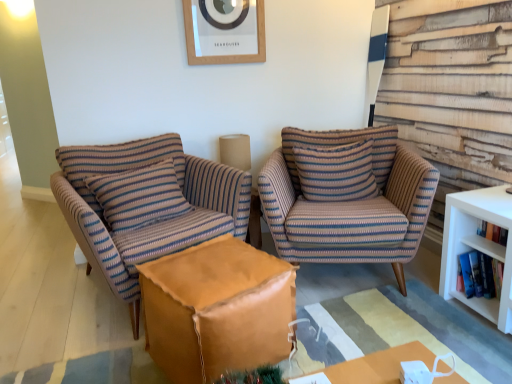
In order to click on striped fabric armchair at left, which is the first chair in left-to-right order in this screenshot , I will do `click(146, 204)`.

What do you see at coordinates (139, 196) in the screenshot? I see `striped fabric pillow at left, which appears as the second pillow when viewed from the right` at bounding box center [139, 196].

At what (x,y) coordinates should I click in order to perform the action: click on white paperbacks at right, positioned as the 1th book in bottom-to-top order. Please return your answer as a coordinate pair (x, y). This screenshot has width=512, height=384. Looking at the image, I should click on (477, 274).

What is the approximate height of striped fabric armchair at center, which appears as the first chair when viewed from the right?

striped fabric armchair at center, which appears as the first chair when viewed from the right, is 31.59 inches tall.

I want to click on leather ottoman at center, so click(x=217, y=309).

Based on the photo, is leather ottoman at center at the left side of white paperbacks at right, positioned as the 1th book in bottom-to-top order?

Correct, you'll find leather ottoman at center to the left of white paperbacks at right, positioned as the 1th book in bottom-to-top order.

Is leather ottoman at center bigger or smaller than white paperbacks at right, positioned as the 1th book in bottom-to-top order?

leather ottoman at center is bigger than white paperbacks at right, positioned as the 1th book in bottom-to-top order.

Is point (221, 335) positioned after point (480, 260)?

No.

Is leather ottoman at center aimed at white paperbacks at right, the second book when ordered from top to bottom?

No, leather ottoman at center is not aimed at white paperbacks at right, the second book when ordered from top to bottom.

Can we say hardcover book at right, arranged as the first book when viewed from the top, lies outside striped fabric pillow at center, the 1th pillow from the right?

That's correct, hardcover book at right, arranged as the first book when viewed from the top, is outside of striped fabric pillow at center, the 1th pillow from the right.

Is hardcover book at right, arranged as the 2th book when ordered from the bottom, oriented towards striped fabric pillow at center, the 2th pillow in the left-to-right sequence?

No, hardcover book at right, arranged as the 2th book when ordered from the bottom, is not oriented towards striped fabric pillow at center, the 2th pillow in the left-to-right sequence.

Can you confirm if white paperbacks at right, positioned as the 1th book in bottom-to-top order, is smaller than striped fabric pillow at center, the 1th pillow from the right?

Indeed, white paperbacks at right, positioned as the 1th book in bottom-to-top order, has a smaller size compared to striped fabric pillow at center, the 1th pillow from the right.

Is white paperbacks at right, positioned as the 1th book in bottom-to-top order, outside of striped fabric pillow at center, the 1th pillow from the right?

Yes, white paperbacks at right, positioned as the 1th book in bottom-to-top order, is located beyond the bounds of striped fabric pillow at center, the 1th pillow from the right.

From the image's perspective, which is below, white paperbacks at right, the second book when ordered from top to bottom, or striped fabric pillow at center, the 2th pillow in the left-to-right sequence?

From the image's view, white paperbacks at right, the second book when ordered from top to bottom, is below.

Locate an element on the screen. The image size is (512, 384). the 2nd pillow above when counting from the white paperbacks at right, the second book when ordered from top to bottom (from the image's perspective) is located at coordinates (336, 171).

Based on the photo, which object is thinner, striped fabric armchair at center, which appears as the first chair when viewed from the right, or striped fabric pillow at left, which appears as the second pillow when viewed from the right?

striped fabric pillow at left, which appears as the second pillow when viewed from the right.

Is striped fabric armchair at center, which is the second chair in left-to-right order, closer to the viewer compared to striped fabric pillow at left, which is the first pillow in left-to-right order?

Yes, the depth of striped fabric armchair at center, which is the second chair in left-to-right order, is less than that of striped fabric pillow at left, which is the first pillow in left-to-right order.

Does striped fabric armchair at center, which appears as the first chair when viewed from the right, appear on the left side of striped fabric pillow at left, which is the first pillow in left-to-right order?

In fact, striped fabric armchair at center, which appears as the first chair when viewed from the right, is to the right of striped fabric pillow at left, which is the first pillow in left-to-right order.

Would you consider striped fabric armchair at center, which is the second chair in left-to-right order, to be distant from striped fabric pillow at left, which is the first pillow in left-to-right order?

No, striped fabric armchair at center, which is the second chair in left-to-right order, is not far away from striped fabric pillow at left, which is the first pillow in left-to-right order.

The height and width of the screenshot is (384, 512). There is a striped fabric armchair at center, which is the second chair in left-to-right order. In order to click on the 2nd book below it (from a real-world perspective) in this screenshot , I will do `click(477, 274)`.

How different are the orientations of striped fabric armchair at center, which appears as the first chair when viewed from the right, and white paperbacks at right, the second book when ordered from top to bottom, in degrees?

The angular difference between striped fabric armchair at center, which appears as the first chair when viewed from the right, and white paperbacks at right, the second book when ordered from top to bottom, is 63.6 degrees.

Considering the sizes of objects striped fabric armchair at center, which is the second chair in left-to-right order, and white paperbacks at right, the second book when ordered from top to bottom, in the image provided, who is wider, striped fabric armchair at center, which is the second chair in left-to-right order, or white paperbacks at right, the second book when ordered from top to bottom,?

striped fabric armchair at center, which is the second chair in left-to-right order, is wider.

Does striped fabric armchair at center, which appears as the first chair when viewed from the right, have a larger size compared to white paperbacks at right, the second book when ordered from top to bottom?

Indeed, striped fabric armchair at center, which appears as the first chair when viewed from the right, has a larger size compared to white paperbacks at right, the second book when ordered from top to bottom.

Could striped fabric armchair at center, which appears as the first chair when viewed from the right, be considered to be inside striped fabric pillow at left, which is the first pillow in left-to-right order?

No.

How different are the orientations of striped fabric pillow at left, which appears as the second pillow when viewed from the right, and striped fabric armchair at center, which is the second chair in left-to-right order, in degrees?

There is a 41.6-degree angle between the facing directions of striped fabric pillow at left, which appears as the second pillow when viewed from the right, and striped fabric armchair at center, which is the second chair in left-to-right order.

Is striped fabric pillow at left, which is the first pillow in left-to-right order, in front of or behind striped fabric armchair at center, which appears as the first chair when viewed from the right, in the image?

striped fabric pillow at left, which is the first pillow in left-to-right order, is behind striped fabric armchair at center, which appears as the first chair when viewed from the right.

Considering the sizes of objects striped fabric pillow at left, which appears as the second pillow when viewed from the right, and striped fabric armchair at center, which is the second chair in left-to-right order, in the image provided, who is thinner, striped fabric pillow at left, which appears as the second pillow when viewed from the right, or striped fabric armchair at center, which is the second chair in left-to-right order,?

striped fabric pillow at left, which appears as the second pillow when viewed from the right, is thinner.

I want to click on the 2nd chair counting from the left of the hardcover book at right, arranged as the 2th book when ordered from the bottom, so click(x=146, y=204).

Is striped fabric armchair at left, which is the first chair in left-to-right order, further to the viewer compared to hardcover book at right, arranged as the first book when viewed from the top?

No, it is not.

Would you consider striped fabric armchair at left, marked as the second chair in a right-to-left arrangement, to be distant from hardcover book at right, arranged as the first book when viewed from the top?

striped fabric armchair at left, marked as the second chair in a right-to-left arrangement, is positioned a significant distance from hardcover book at right, arranged as the first book when viewed from the top.

From the image's perspective, is striped fabric armchair at left, which is the first chair in left-to-right order, over hardcover book at right, arranged as the 2th book when ordered from the bottom?

Yes, from the image's perspective, striped fabric armchair at left, which is the first chair in left-to-right order, is above hardcover book at right, arranged as the 2th book when ordered from the bottom.

Identify the location of the 2nd book behind the leather ottoman at center. (477, 274).

From the image's perspective, which pillow is the 2nd one above the hardcover book at right, arranged as the 2th book when ordered from the bottom? Please provide its 2D coordinates.

[(336, 171)]

Estimate the real-world distances between objects in this image. Which object is closer to striped fabric armchair at center, which appears as the first chair when viewed from the right, striped fabric pillow at center, the 2th pillow in the left-to-right sequence, or striped fabric armchair at left, which is the first chair in left-to-right order?

The object closer to striped fabric armchair at center, which appears as the first chair when viewed from the right, is striped fabric pillow at center, the 2th pillow in the left-to-right sequence.

Based on their spatial positions, is striped fabric pillow at center, the 2th pillow in the left-to-right sequence, or white paperbacks at right, positioned as the 1th book in bottom-to-top order, closer to leather ottoman at center?

striped fabric pillow at center, the 2th pillow in the left-to-right sequence, is closer to leather ottoman at center.

When comparing their distances from striped fabric armchair at center, which is the second chair in left-to-right order, does wooden picture frame at upper center or striped fabric pillow at center, the 2th pillow in the left-to-right sequence, seem further?

wooden picture frame at upper center is further to striped fabric armchair at center, which is the second chair in left-to-right order.

When comparing their distances from leather ottoman at center, does white paperbacks at right, positioned as the 1th book in bottom-to-top order, or striped fabric armchair at center, which appears as the first chair when viewed from the right, seem further?

white paperbacks at right, positioned as the 1th book in bottom-to-top order, is positioned further to the anchor leather ottoman at center.

Estimate the real-world distances between objects in this image. Which object is further from wooden picture frame at upper center, striped fabric armchair at left, marked as the second chair in a right-to-left arrangement, or leather ottoman at center?

leather ottoman at center is positioned further to the anchor wooden picture frame at upper center.

When comparing their distances from striped fabric pillow at left, which is the first pillow in left-to-right order, does hardcover book at right, arranged as the first book when viewed from the top, or striped fabric armchair at center, which is the second chair in left-to-right order, seem further?

Based on the image, hardcover book at right, arranged as the first book when viewed from the top, appears to be further to striped fabric pillow at left, which is the first pillow in left-to-right order.

From the image, which object appears to be nearer to leather ottoman at center, white paperbacks at right, the second book when ordered from top to bottom, or hardcover book at right, arranged as the 2th book when ordered from the bottom?

Among the two, white paperbacks at right, the second book when ordered from top to bottom, is located nearer to leather ottoman at center.

Estimate the real-world distances between objects in this image. Which object is closer to hardcover book at right, arranged as the first book when viewed from the top, leather ottoman at center or striped fabric pillow at center, the 1th pillow from the right?

The object closer to hardcover book at right, arranged as the first book when viewed from the top, is striped fabric pillow at center, the 1th pillow from the right.

At what (x,y) coordinates should I click in order to perform the action: click on chair between striped fabric pillow at center, the 1th pillow from the right, and hardcover book at right, arranged as the first book when viewed from the top. Please return your answer as a coordinate pair (x, y). Looking at the image, I should click on (349, 204).

The height and width of the screenshot is (384, 512). In order to click on table located between striped fabric armchair at left, which is the first chair in left-to-right order, and white paperbacks at right, positioned as the 1th book in bottom-to-top order, in the left-right direction in this screenshot , I will do `click(217, 309)`.

You are a GUI agent. You are given a task and a screenshot of the screen. Output one action in this format:
    pyautogui.click(x=<x>, y=<y>)
    Task: Click on the table between striped fabric pillow at left, which is the first pillow in left-to-right order, and hardcover book at right, arranged as the 2th book when ordered from the bottom
    The image size is (512, 384).
    Given the screenshot: What is the action you would take?
    pyautogui.click(x=217, y=309)

The width and height of the screenshot is (512, 384). I want to click on book between striped fabric armchair at center, which appears as the first chair when viewed from the right, and white paperbacks at right, the second book when ordered from top to bottom, from left to right, so pyautogui.click(x=493, y=232).